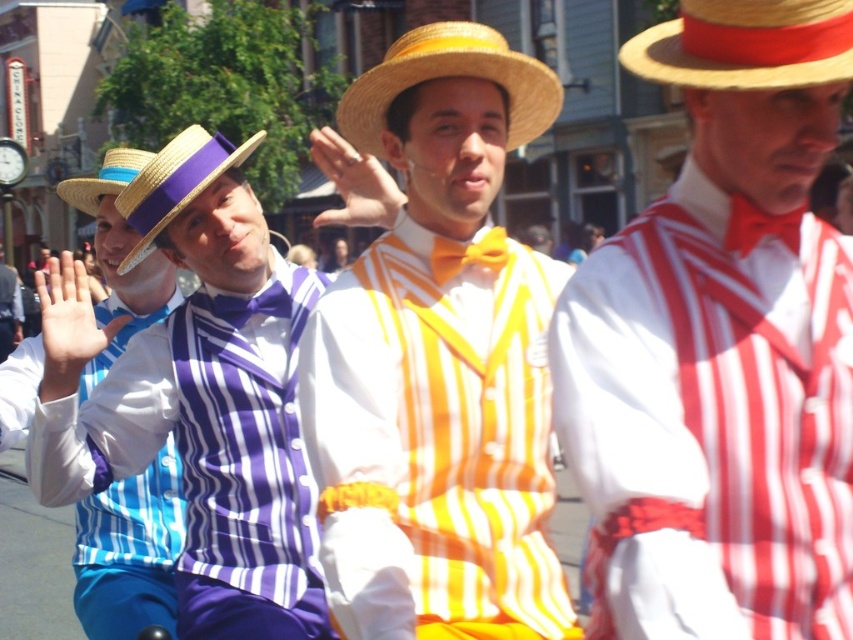
You are a photographer trying to capture a closeup of the red and white striped shirt at center and the straw hat at center. Given their sizes, which one will require you to move closer to get a clear shot?

The red and white striped shirt at center occupies less space than the straw hat at center, so you will need to move closer to the red and white striped shirt at center to capture it clearly in the photo.

You are a photographer standing at the edge of the street, wanting to capture both the red and white striped shirt at center and the straw hat at center in a single frame. Your camera has a focal length that can cover up to 7 feet. Will you be able to include both subjects in your photo without moving closer?

The distance between the red and white striped shirt at center and the straw hat at center is 7.32 feet. Since your camera can only cover up to 7 feet, you will not be able to include both subjects in a single frame without moving closer.